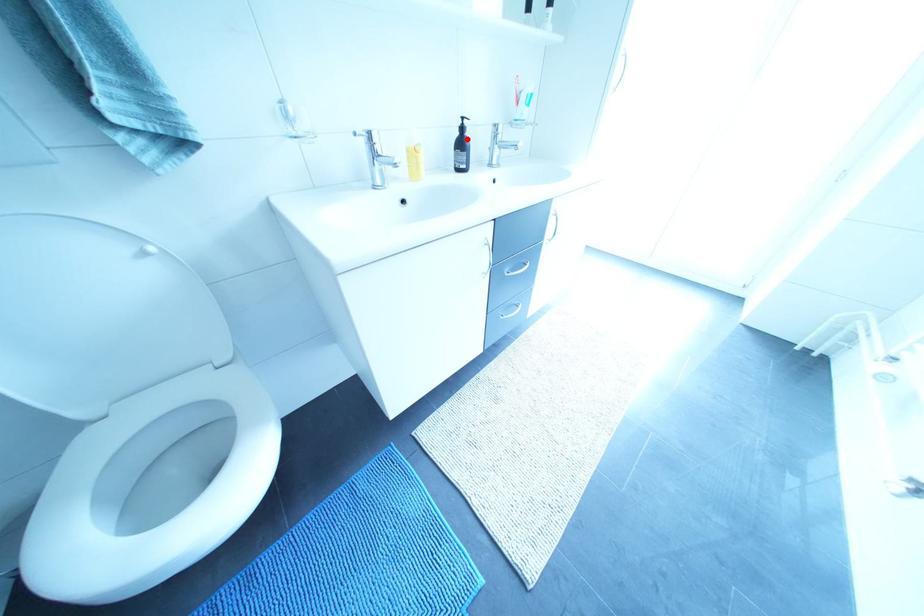
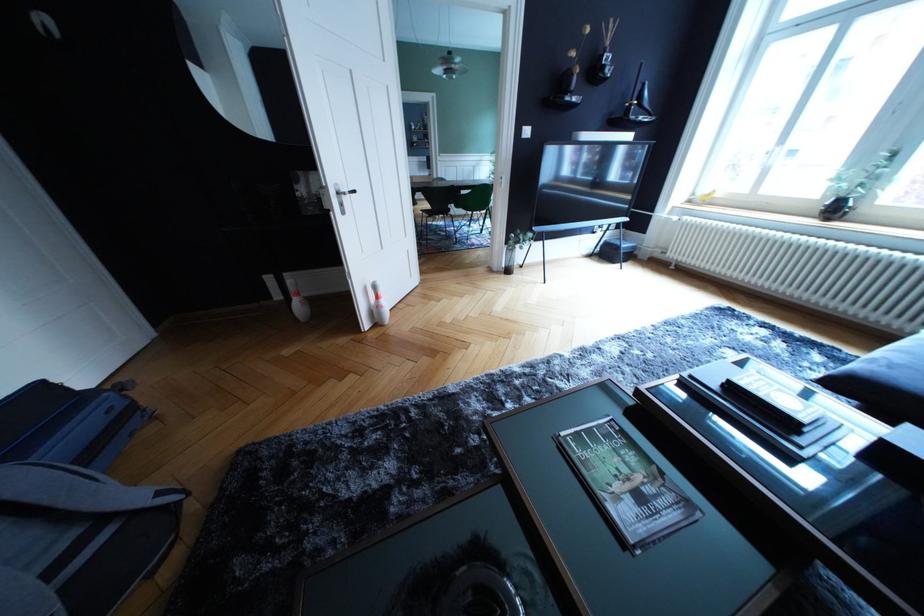
Question: I am providing you with two images of the same scene from different viewpoints. A red point is marked on the first image. At the location where the point appears in image 1, is it still visible in image 2?

Choices:
 (A) Yes
 (B) No

Answer: (B)